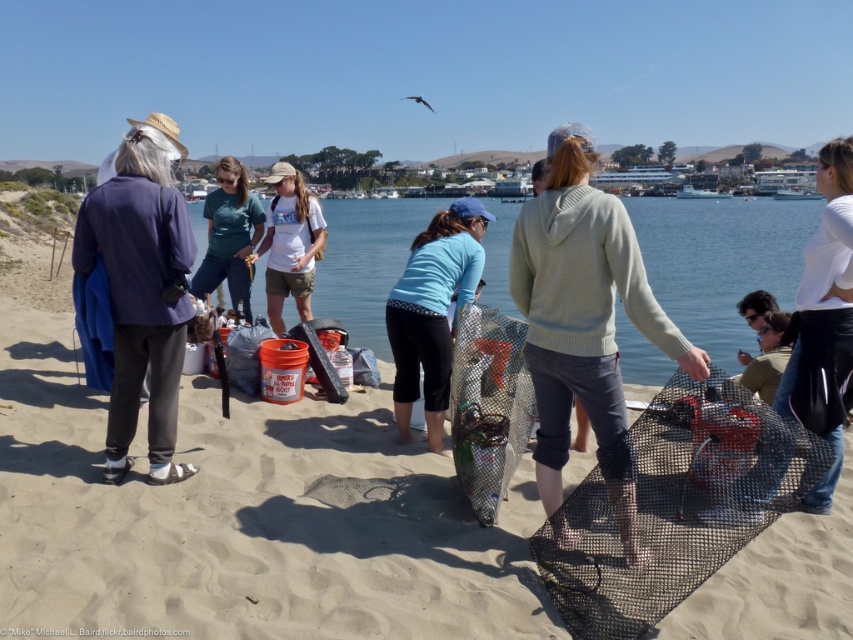
Which is more to the right, black mesh net at center or blue fabric shirt at center?

black mesh net at center

Is black mesh net at center thinner than blue fabric shirt at center?

Incorrect, black mesh net at center's width is not less than blue fabric shirt at center's.

Who is more forward, (x=653, y=573) or (x=397, y=320)?

Point (x=653, y=573)

Locate an element on the screen. Image resolution: width=853 pixels, height=640 pixels. black mesh net at center is located at coordinates (675, 502).

Does light gray sweater at center have a lesser height compared to blue fabric shirt at center?

Yes.

Does light gray sweater at center appear on the right side of blue fabric shirt at center?

Indeed, light gray sweater at center is positioned on the right side of blue fabric shirt at center.

Describe the element at coordinates (584, 330) in the screenshot. The height and width of the screenshot is (640, 853). I see `light gray sweater at center` at that location.

I want to click on light gray sweater at center, so click(584, 330).

How distant is white matte shirt at upper right from blue fabric shirt at center?

A distance of 9.02 feet exists between white matte shirt at upper right and blue fabric shirt at center.

Who is more forward, (x=846, y=332) or (x=399, y=362)?

Point (x=846, y=332)

Between point (839, 276) and point (408, 422), which one is positioned in front?

Point (839, 276)

Where is `white matte shirt at upper right`? This screenshot has width=853, height=640. white matte shirt at upper right is located at coordinates (824, 323).